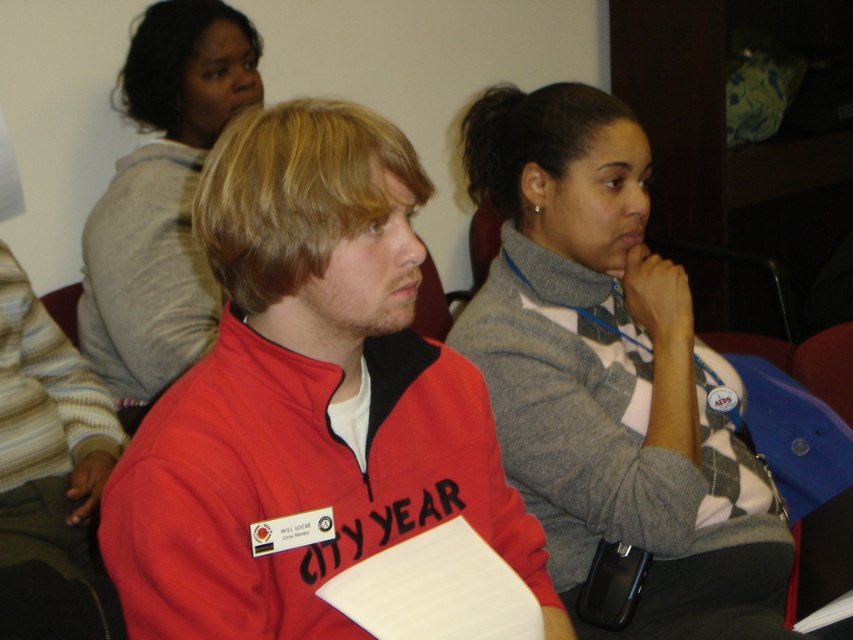
Question: Does red fleece sweatshirt at center appear on the right side of gray sweater at center?

Choices:
 (A) yes
 (B) no

Answer: (B)

Question: Can you confirm if gray sweater at center is thinner than gray sweater at upper center?

Choices:
 (A) yes
 (B) no

Answer: (B)

Question: Among these points, which one is nearest to the camera?

Choices:
 (A) (316, 394)
 (B) (96, 204)

Answer: (A)

Question: Which point appears closest to the camera in this image?

Choices:
 (A) (769, 525)
 (B) (305, 472)

Answer: (B)

Question: Which point appears farthest from the camera in this image?

Choices:
 (A) (409, 524)
 (B) (657, 332)

Answer: (B)

Question: Is red fleece sweatshirt at center to the right of gray sweater at upper center from the viewer's perspective?

Choices:
 (A) no
 (B) yes

Answer: (B)